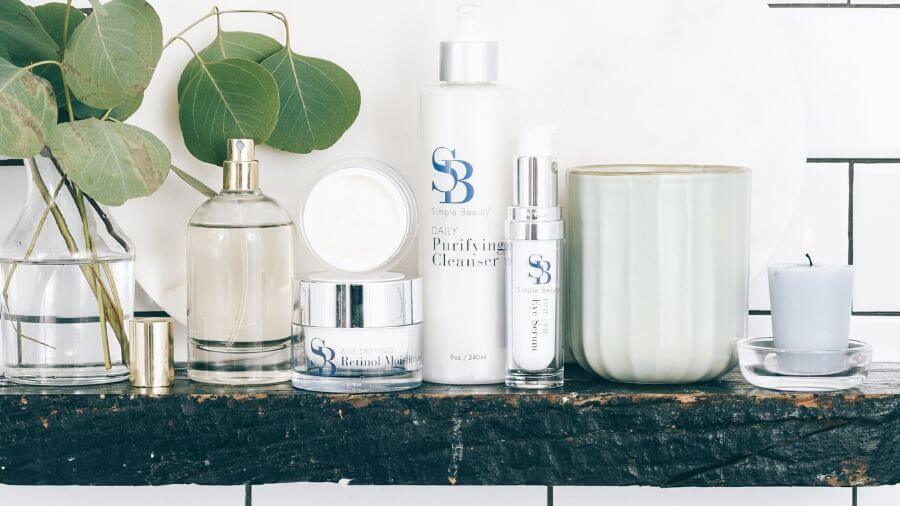
I want to click on candle, so click(797, 305).